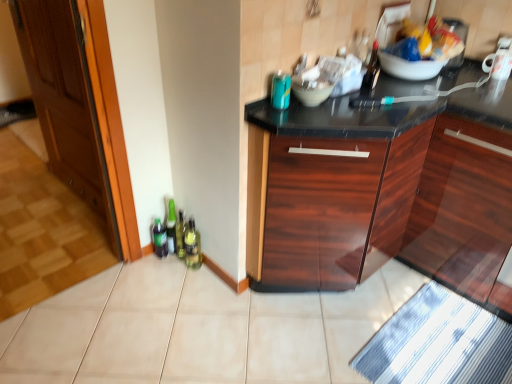
In order to face wooden at left, should I rotate leftwards or rightwards?

Turn left approximately 27.775 degrees to face it.

In order to face green glass bottle at lower left, should I rotate leftwards or rightwards?

To align with it, rotate left about 8.875°.

At what (x,y) coordinates should I click in order to perform the action: click on green glass bottle at lower left. Please return your answer as a coordinate pair (x, y). This screenshot has height=384, width=512. Looking at the image, I should click on (192, 246).

What is the approximate width of white glossy mug at upper right?

white glossy mug at upper right is 8.79 centimeters wide.

In order to click on blue striped bath mat at lower right in this screenshot , I will do `click(438, 343)`.

Find the location of a particular element. wooden at left is located at coordinates (54, 168).

Which object is thinner, plastic bag of chips at upper center or blue striped bath mat at lower right?

plastic bag of chips at upper center is thinner.

Are plastic bag of chips at upper center and blue striped bath mat at lower right located far from each other?

That's right, there is a large distance between plastic bag of chips at upper center and blue striped bath mat at lower right.

Can you confirm if plastic bag of chips at upper center is smaller than blue striped bath mat at lower right?

Correct, plastic bag of chips at upper center occupies less space than blue striped bath mat at lower right.

From a real-world perspective, which object stands above the other?

From a 3D spatial view, plastic bag of chips at upper center is above.

Does wooden at left have a lesser height compared to glossy wood cabinet at center?

In fact, wooden at left may be taller than glossy wood cabinet at center.

Is glossy wood cabinet at center at the back of wooden at left?

That's not correct — wooden at left is not looking away from glossy wood cabinet at center.

Is wooden at left surrounding glossy wood cabinet at center?

No, glossy wood cabinet at center is not a part of wooden at left.

From a real-world perspective, is wooden at left positioned over glossy wood cabinet at center based on gravity?

Yes.

Considering the relative sizes of blue striped bath mat at lower right and matte white bowl at center in the image provided, is blue striped bath mat at lower right shorter than matte white bowl at center?

Correct, blue striped bath mat at lower right is not as tall as matte white bowl at center.

Is blue striped bath mat at lower right outside of matte white bowl at center?

blue striped bath mat at lower right is positioned outside matte white bowl at center.

Considering the relative positions of blue striped bath mat at lower right and matte white bowl at center in the image provided, is blue striped bath mat at lower right to the left or to the right of matte white bowl at center?

blue striped bath mat at lower right is to the right of matte white bowl at center.

Considering the positions of point (440, 311) and point (313, 90), is point (440, 311) closer or farther from the camera than point (313, 90)?

Clearly, point (440, 311) is more distant from the camera than point (313, 90).

Is matte white bowl at center taller than white glossy mug at upper right?

No.

From a real-world perspective, is matte white bowl at center located beneath white glossy mug at upper right?

Yes, from a real-world perspective, matte white bowl at center is below white glossy mug at upper right.

Considering the positions of objects matte white bowl at center and white glossy mug at upper right in the image provided, who is more to the right, matte white bowl at center or white glossy mug at upper right?

From the viewer's perspective, white glossy mug at upper right appears more on the right side.

Is plastic bag of chips at upper center closer to the viewer compared to white glossy mug at upper right?

That is True.

From a real-world perspective, which object stands above the other?

From a 3D spatial view, plastic bag of chips at upper center is above.

Is plastic bag of chips at upper center at the left side of white glossy mug at upper right?

Indeed, plastic bag of chips at upper center is positioned on the left side of white glossy mug at upper right.

Is matte white bowl at center located within green glass bottle at lower left?

Actually, matte white bowl at center is outside green glass bottle at lower left.

Considering the positions of point (194, 229) and point (316, 92), is point (194, 229) closer or farther from the camera than point (316, 92)?

Point (194, 229).

What's the angular difference between green glass bottle at lower left and matte white bowl at center's facing directions?

5.2 degrees separate the facing orientations of green glass bottle at lower left and matte white bowl at center.

Is green glass bottle at lower left wider or thinner than matte white bowl at center?

Considering their sizes, green glass bottle at lower left looks slimmer than matte white bowl at center.

Is white glossy mug at upper right thinner than matte white bowl at center?

Correct, the width of white glossy mug at upper right is less than that of matte white bowl at center.

Would you say white glossy mug at upper right is to the left or to the right of matte white bowl at center in the picture?

Clearly, white glossy mug at upper right is on the right of matte white bowl at center in the image.

From the image's perspective, which one is positioned lower, white glossy mug at upper right or matte white bowl at center?

matte white bowl at center, from the image's perspective.

Which of these two, white glossy mug at upper right or matte white bowl at center, stands taller?

Standing taller between the two is white glossy mug at upper right.

You are a GUI agent. You are given a task and a screenshot of the screen. Output one action in this format:
    pyautogui.click(x=<x>, y=<y>)
    Task: Click on the food that appears on the left of blue striped bath mat at lower right
    The width and height of the screenshot is (512, 384).
    Given the screenshot: What is the action you would take?
    pyautogui.click(x=430, y=40)

There is a glossy wood cabinet at center. Where is `door above it (from a real-world perspective)`? This screenshot has height=384, width=512. door above it (from a real-world perspective) is located at coordinates (54, 168).

When comparing their distances from wooden at left, does glossy wood cabinet at center or blue striped bath mat at lower right seem closer?

Based on the image, glossy wood cabinet at center appears to be nearer to wooden at left.

Estimate the real-world distances between objects in this image. Which object is further from plastic bag of chips at upper center, white glossy mug at upper right or matte white bowl at center?

matte white bowl at center lies further to plastic bag of chips at upper center than the other object.

When comparing their distances from plastic bag of chips at upper center, does glossy wood cabinet at center or matte white bowl at center seem further?

matte white bowl at center.

When comparing their distances from blue striped bath mat at lower right, does wooden at left or green glass bottle at lower left seem further?

wooden at left is positioned further to the anchor blue striped bath mat at lower right.

When comparing their distances from wooden at left, does matte white bowl at center or green glass bottle at lower left seem closer?

The object closer to wooden at left is green glass bottle at lower left.

From the image, which object appears to be farther from green glass bottle at lower left, blue striped bath mat at lower right or wooden at left?

blue striped bath mat at lower right is further to green glass bottle at lower left.

From the image, which object appears to be farther from blue striped bath mat at lower right, green glass bottle at lower left or matte white bowl at center?

matte white bowl at center is positioned further to the anchor blue striped bath mat at lower right.

Estimate the real-world distances between objects in this image. Which object is further from glossy wood cabinet at center, blue striped bath mat at lower right or wooden at left?

The object further to glossy wood cabinet at center is wooden at left.

Locate an element on the screen. The width and height of the screenshot is (512, 384). food between glossy wood cabinet at center and white glossy mug at upper right along the z-axis is located at coordinates (430, 40).

The height and width of the screenshot is (384, 512). I want to click on cabinetry between green glass bottle at lower left and blue striped bath mat at lower right, so click(414, 188).

Identify the location of mixing bowl between green glass bottle at lower left and plastic bag of chips at upper center from left to right. (311, 91).

Identify the location of food between wooden at left and blue striped bath mat at lower right from left to right. The height and width of the screenshot is (384, 512). (430, 40).